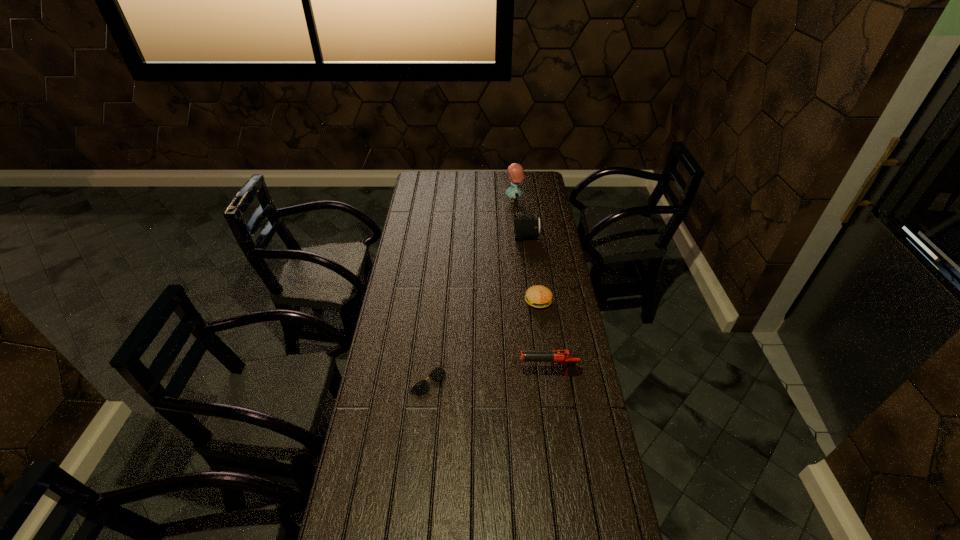
Identify the location of vacant region located 0.160m on the front-facing side of the doll. (475, 200).

At what (x,y) coordinates should I click in order to perform the action: click on free spot located 0.330m at the front element of the second farthest object. Please return your answer as a coordinate pair (x, y). The image size is (960, 540). Looking at the image, I should click on (x=447, y=237).

Locate an element on the screen. This screenshot has width=960, height=540. vacant space located 0.280m at the front element of the second farthest object is located at coordinates (458, 237).

Find the location of `blank space located 0.190m at the front element of the second farthest object`. blank space located 0.190m at the front element of the second farthest object is located at coordinates (476, 237).

What are the coordinates of `vacant space situated at the aiming end of the gun` in the screenshot? It's located at (454, 374).

You are a GUI agent. You are given a task and a screenshot of the screen. Output one action in this format:
    pyautogui.click(x=<x>, y=<y>)
    Task: Click on the blank space located at the aiming end of the gun
    This screenshot has height=540, width=960.
    Given the screenshot: What is the action you would take?
    444,374

Locate an element on the screen. The image size is (960, 540). vacant region located at the aiming end of the gun is located at coordinates (432, 374).

The image size is (960, 540). Identify the location of blank area located on the front of the third nearest object. (550, 388).

This screenshot has width=960, height=540. What are the coordinates of `vacant region located on the left of the shortest object` in the screenshot? It's located at (372, 380).

This screenshot has width=960, height=540. Find the location of `object that is at the far edge`. object that is at the far edge is located at coordinates point(516,173).